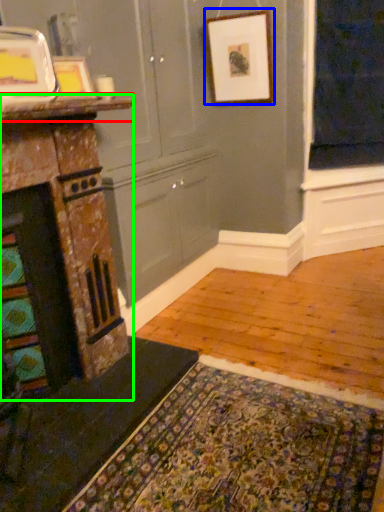
Question: Which object is the closest to the counter top (highlighted by a red box)? Choose among these: picture frame (highlighted by a blue box) or fireplace (highlighted by a green box).

Choices:
 (A) picture frame
 (B) fireplace

Answer: (B)